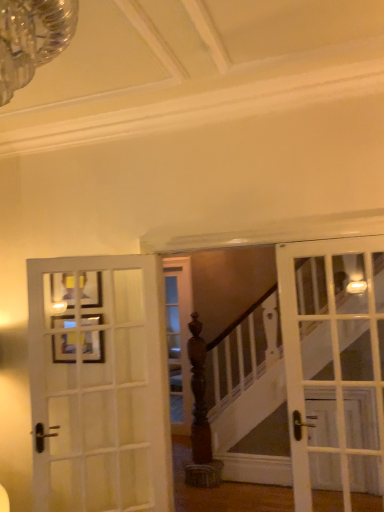
Question: Are white wood door at left, arranged as the 2th door when viewed from the right, and wooden picture frame at upper left far apart?

Choices:
 (A) no
 (B) yes

Answer: (A)

Question: Can wooden picture frame at upper left be found inside white wood door at left, arranged as the 1th door when viewed from the left?

Choices:
 (A) no
 (B) yes

Answer: (A)

Question: Does white wood door at left, arranged as the 1th door when viewed from the left, have a lesser width compared to wooden picture frame at upper left?

Choices:
 (A) yes
 (B) no

Answer: (B)

Question: From the image's perspective, does white wood door at left, arranged as the 1th door when viewed from the left, appear higher than wooden picture frame at upper left?

Choices:
 (A) yes
 (B) no

Answer: (B)

Question: Considering the relative sizes of white wood door at left, arranged as the 1th door when viewed from the left, and wooden picture frame at upper left in the image provided, is white wood door at left, arranged as the 1th door when viewed from the left, smaller than wooden picture frame at upper left?

Choices:
 (A) yes
 (B) no

Answer: (B)

Question: Can you confirm if white wood door at left, arranged as the 2th door when viewed from the right, is positioned to the right of wooden picture frame at upper left?

Choices:
 (A) no
 (B) yes

Answer: (B)

Question: Can you confirm if wooden picture frame at upper left is shorter than white glass door at right, marked as the first door in a right-to-left arrangement?

Choices:
 (A) yes
 (B) no

Answer: (A)

Question: Is wooden picture frame at upper left positioned far away from white glass door at right, the 2th door when ordered from left to right?

Choices:
 (A) no
 (B) yes

Answer: (B)

Question: Is wooden picture frame at upper left closer to camera compared to white glass door at right, marked as the first door in a right-to-left arrangement?

Choices:
 (A) yes
 (B) no

Answer: (B)

Question: Are wooden picture frame at upper left and white glass door at right, the 2th door when ordered from left to right, beside each other?

Choices:
 (A) yes
 (B) no

Answer: (B)

Question: Is white glass door at right, the 2th door when ordered from left to right, at the back of wooden picture frame at upper left?

Choices:
 (A) yes
 (B) no

Answer: (B)

Question: Does wooden picture frame at upper left contain white glass door at right, marked as the first door in a right-to-left arrangement?

Choices:
 (A) yes
 (B) no

Answer: (B)

Question: Can you confirm if wooden picture frame at upper left is positioned to the right of white wood door at left, arranged as the 2th door when viewed from the right?

Choices:
 (A) yes
 (B) no

Answer: (B)